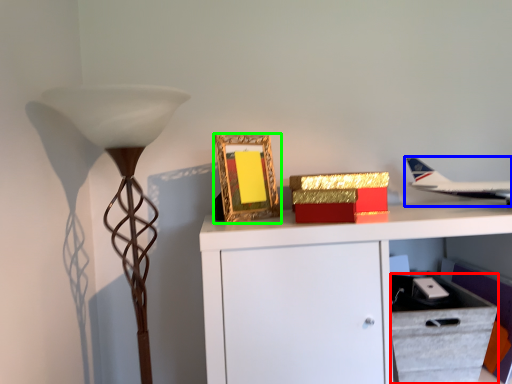
Question: Based on their relative distances, which object is nearer to drawer (highlighted by a red box)? Choose from airplane (highlighted by a blue box) and picture frame (highlighted by a green box).

Choices:
 (A) airplane
 (B) picture frame

Answer: (A)